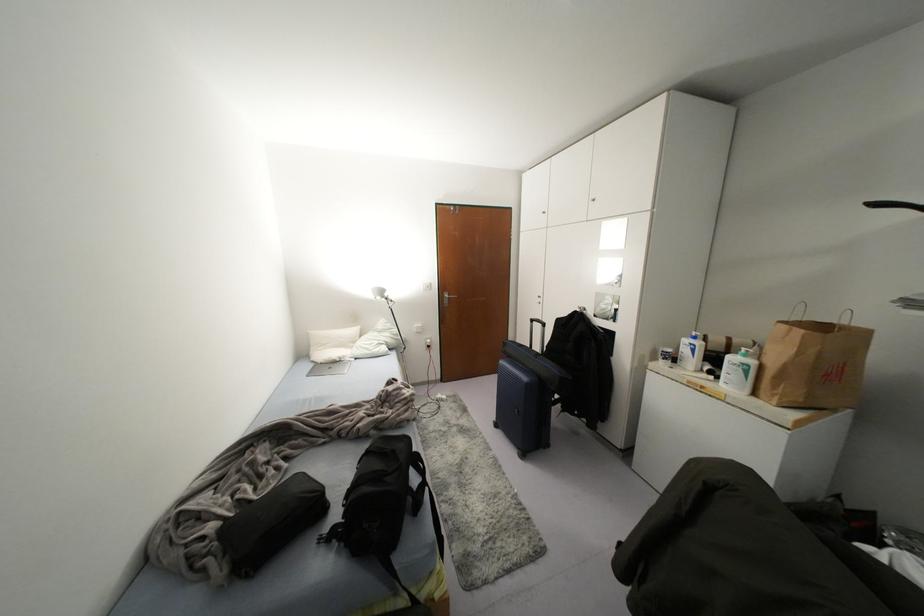
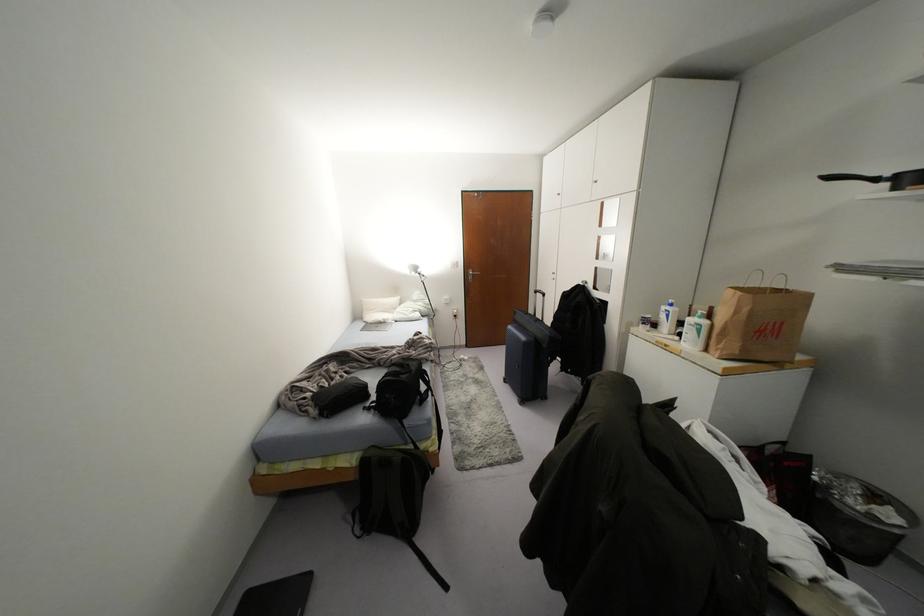
Locate, in the second image, the point that corresponds to [445,301] in the first image.

(469, 277)